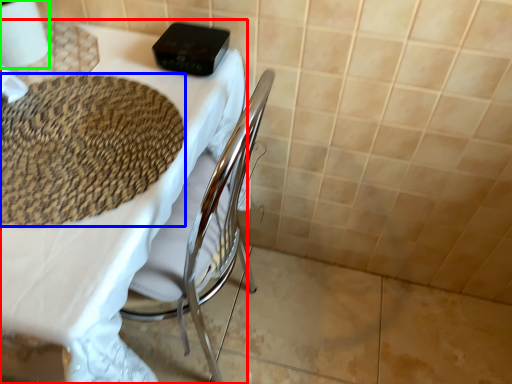
Question: Considering the real-world distances, which object is closest to table (highlighted by a red box)? mat (highlighted by a blue box) or toilet paper (highlighted by a green box).

Choices:
 (A) mat
 (B) toilet paper

Answer: (A)